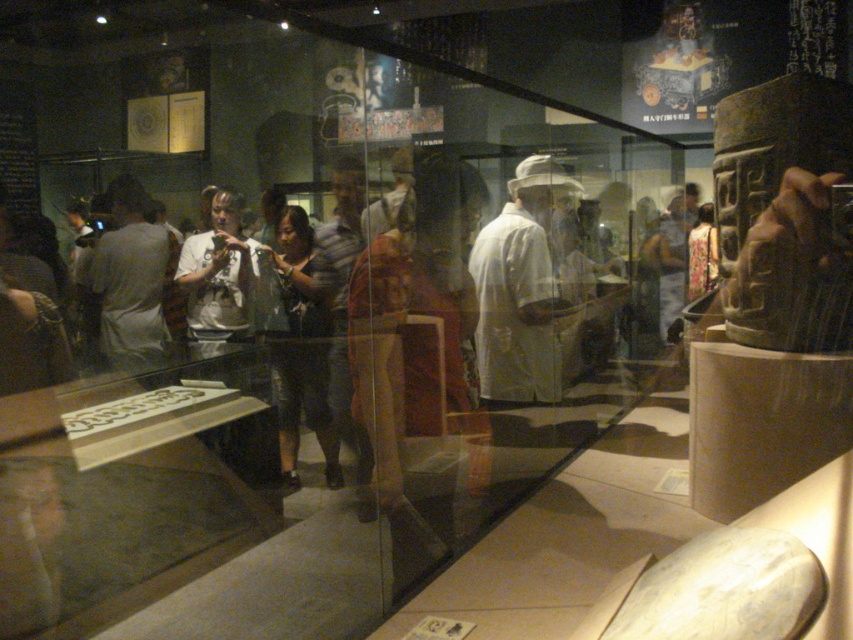
Question: Which point appears farthest from the camera in this image?

Choices:
 (A) (136, 250)
 (B) (500, 380)

Answer: (A)

Question: Is white matte shirt at center closer to the viewer compared to dark gray fabric shirt at center?

Choices:
 (A) no
 (B) yes

Answer: (A)

Question: Estimate the real-world distances between objects in this image. Which object is closer to the dark gray fabric shirt at center?

Choices:
 (A) white matte shirt at center
 (B) light gray shirt at left

Answer: (B)

Question: Which of the following is the farthest from the observer?

Choices:
 (A) light gray shirt at left
 (B) dark gray fabric shirt at center
 (C) white matte shirt at center

Answer: (A)

Question: Is white matte shirt at center smaller than light gray shirt at left?

Choices:
 (A) yes
 (B) no

Answer: (B)

Question: Is white matte shirt at center to the left of light gray shirt at left from the viewer's perspective?

Choices:
 (A) no
 (B) yes

Answer: (A)